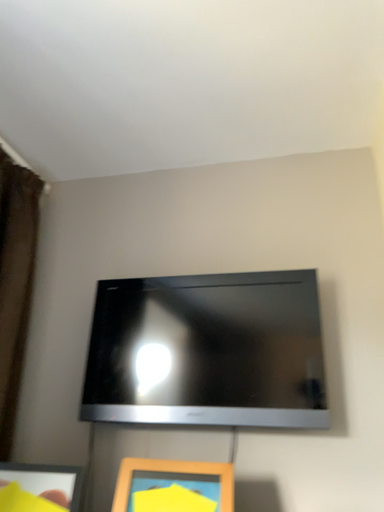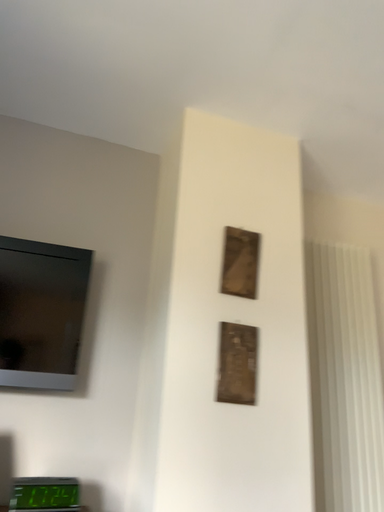
Question: How did the camera likely rotate when shooting the video?

Choices:
 (A) rotated right
 (B) rotated left

Answer: (A)